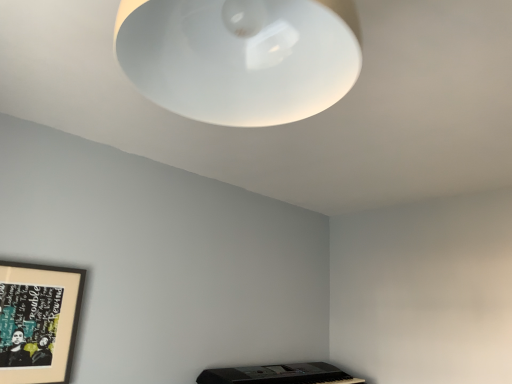
Question: From a real-world perspective, is white matte lampshade at upper center physically located above or below wooden framed artwork at lower left?

Choices:
 (A) above
 (B) below

Answer: (A)

Question: Looking at the image, does white matte lampshade at upper center seem bigger or smaller compared to wooden framed artwork at lower left?

Choices:
 (A) big
 (B) small

Answer: (A)

Question: Considering the positions of point (172, 41) and point (66, 294), is point (172, 41) closer or farther from the camera than point (66, 294)?

Choices:
 (A) farther
 (B) closer

Answer: (B)

Question: Based on their sizes in the image, would you say wooden framed artwork at lower left is bigger or smaller than white matte lampshade at upper center?

Choices:
 (A) small
 (B) big

Answer: (A)

Question: Looking at their shapes, would you say wooden framed artwork at lower left is wider or thinner than white matte lampshade at upper center?

Choices:
 (A) thin
 (B) wide

Answer: (A)

Question: In terms of height, does wooden framed artwork at lower left look taller or shorter compared to white matte lampshade at upper center?

Choices:
 (A) tall
 (B) short

Answer: (A)

Question: From the image's perspective, relative to white matte lampshade at upper center, is wooden framed artwork at lower left above or below?

Choices:
 (A) below
 (B) above

Answer: (A)